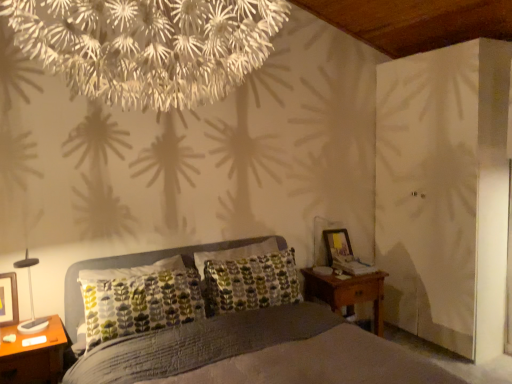
Identify the location of empty space that is ontop of wooden nightstand at lower left, which is the 1th nightstand in left-to-right order (from a real-world perspective). The width and height of the screenshot is (512, 384). pyautogui.click(x=28, y=327).